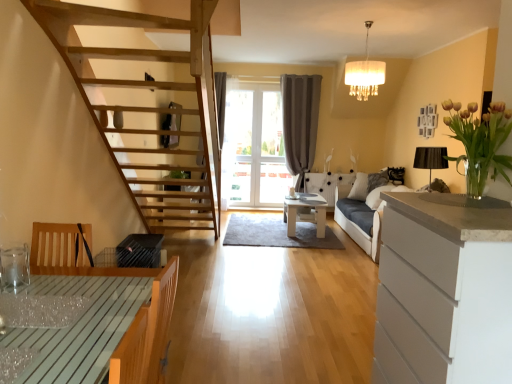
Question: Which direction should I rotate to look at white glossy table at center, the second table when ordered from left to right, — up or down?

Choices:
 (A) down
 (B) up

Answer: (A)

Question: Considering the relative sizes of gray fabric curtain at center and translucent glass vase at upper right in the image provided, is gray fabric curtain at center taller than translucent glass vase at upper right?

Choices:
 (A) no
 (B) yes

Answer: (B)

Question: Does gray fabric curtain at center have a smaller size compared to translucent glass vase at upper right?

Choices:
 (A) yes
 (B) no

Answer: (B)

Question: Is the position of gray fabric curtain at center more distant than that of translucent glass vase at upper right?

Choices:
 (A) yes
 (B) no

Answer: (A)

Question: Is gray fabric curtain at center in contact with translucent glass vase at upper right?

Choices:
 (A) yes
 (B) no

Answer: (B)

Question: Can you confirm if gray fabric curtain at center is bigger than translucent glass vase at upper right?

Choices:
 (A) no
 (B) yes

Answer: (B)

Question: Is gray fabric curtain at center shorter than translucent glass vase at upper right?

Choices:
 (A) yes
 (B) no

Answer: (B)

Question: From the image's perspective, is white matte cabinet at right located above wooden table at lower left, arranged as the 2th table when viewed from the back?

Choices:
 (A) yes
 (B) no

Answer: (A)

Question: From the image's perspective, is white matte cabinet at right below wooden table at lower left, the first table positioned from the left?

Choices:
 (A) yes
 (B) no

Answer: (B)

Question: Is white matte cabinet at right next to wooden table at lower left, arranged as the 2th table when viewed from the back?

Choices:
 (A) yes
 (B) no

Answer: (B)

Question: Does white matte cabinet at right appear on the left side of wooden table at lower left, arranged as the 2th table when viewed from the back?

Choices:
 (A) yes
 (B) no

Answer: (B)

Question: Is white matte cabinet at right shorter than wooden table at lower left, the first table positioned from the left?

Choices:
 (A) no
 (B) yes

Answer: (A)

Question: Does white matte cabinet at right have a greater width compared to wooden table at lower left, the first table viewed from the front?

Choices:
 (A) yes
 (B) no

Answer: (B)

Question: From the image's perspective, is white glossy table at center, the second table when ordered from left to right, below dark gray fabric couch at right?

Choices:
 (A) no
 (B) yes

Answer: (B)